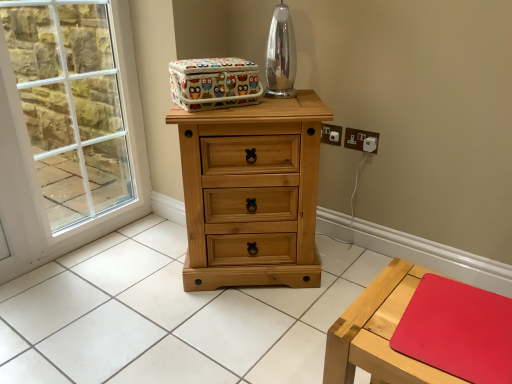
You are a GUI agent. You are given a task and a screenshot of the screen. Output one action in this format:
    pyautogui.click(x=<x>, y=<y>)
    Task: Click on the vacant region to the left of natural wood chest of drawers at center
    
    Given the screenshot: What is the action you would take?
    pyautogui.click(x=139, y=269)